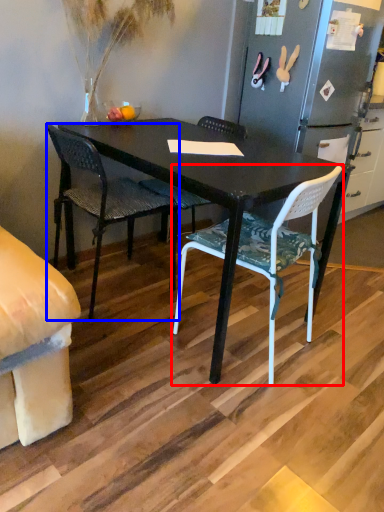
Question: Which object is closer to the camera taking this photo, chair (highlighted by a red box) or chair (highlighted by a blue box)?

Choices:
 (A) chair
 (B) chair

Answer: (A)